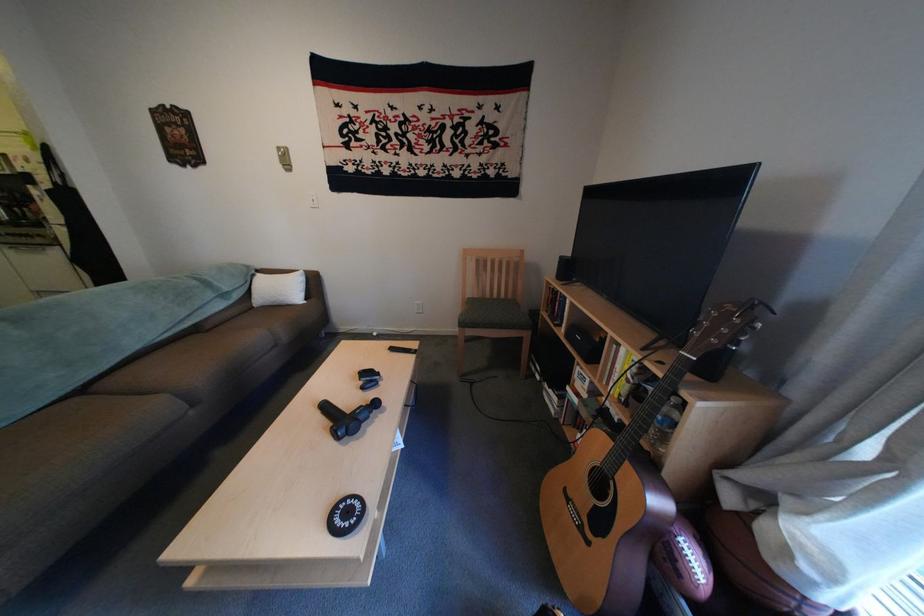
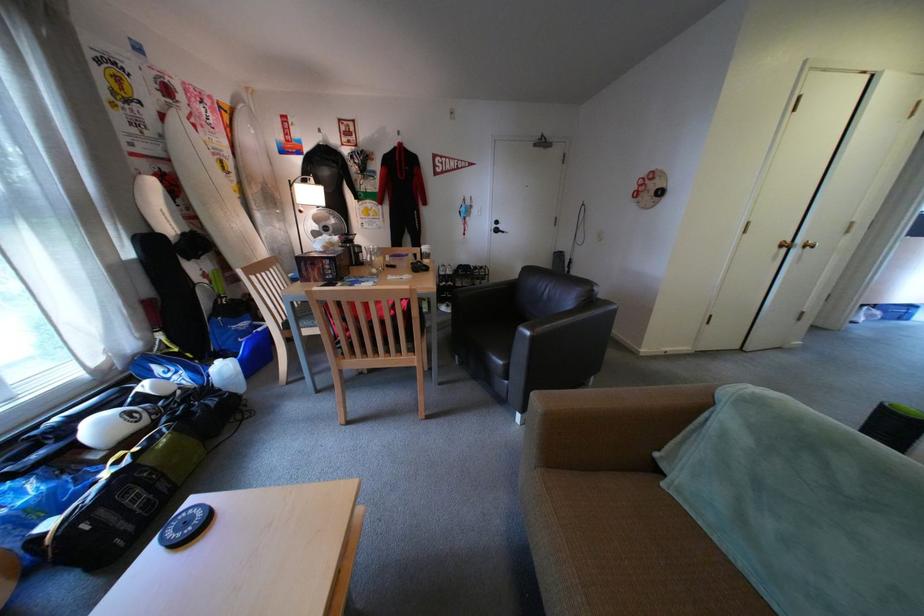
Where in the second image is the point corresponding to [362,514] from the first image?

(199, 525)